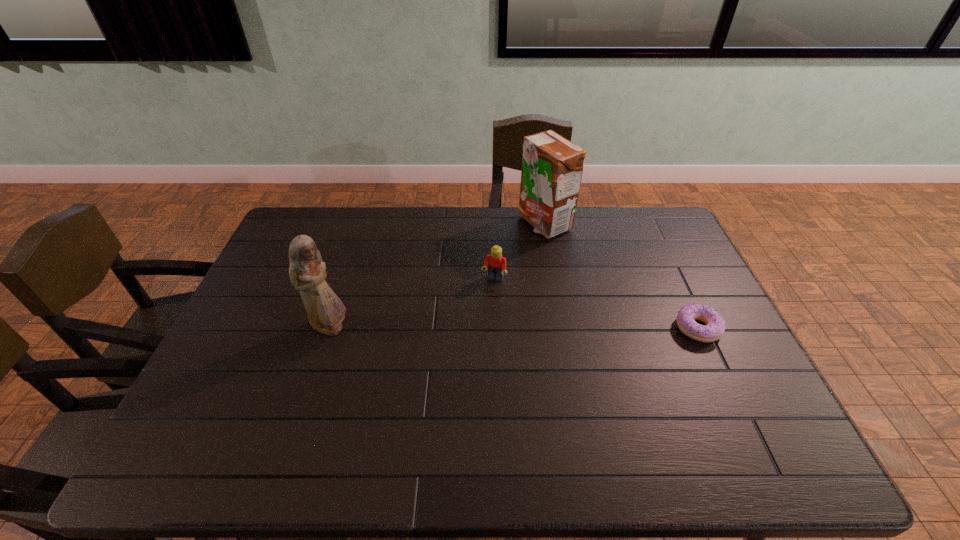
Where is `vacant space in between the figurine and the third tallest object`? vacant space in between the figurine and the third tallest object is located at coordinates (412, 304).

At what (x,y) coordinates should I click in order to perform the action: click on free space that is in between the shortest object and the carton. Please return your answer as a coordinate pair (x, y). This screenshot has width=960, height=540. Looking at the image, I should click on (621, 276).

Find the location of a particular element. The width and height of the screenshot is (960, 540). the second closest object to the figurine is located at coordinates (552, 166).

Select which object is the third closest to the carton. Please provide its 2D coordinates. Your answer should be formatted as a tuple, i.e. [(x, y)], where the tuple contains the x and y coordinates of a point satisfying the conditions above.

[(325, 310)]

The width and height of the screenshot is (960, 540). What are the coordinates of `free space that satisfies the following two spatial constraints: 1. on the back side of the farthest object; 2. on the left side of the third object from right to left` in the screenshot? It's located at (492, 224).

What are the coordinates of `vacant region that satisfies the following two spatial constraints: 1. on the front side of the second object from left to right; 2. on the right side of the rightmost object` in the screenshot? It's located at (495, 328).